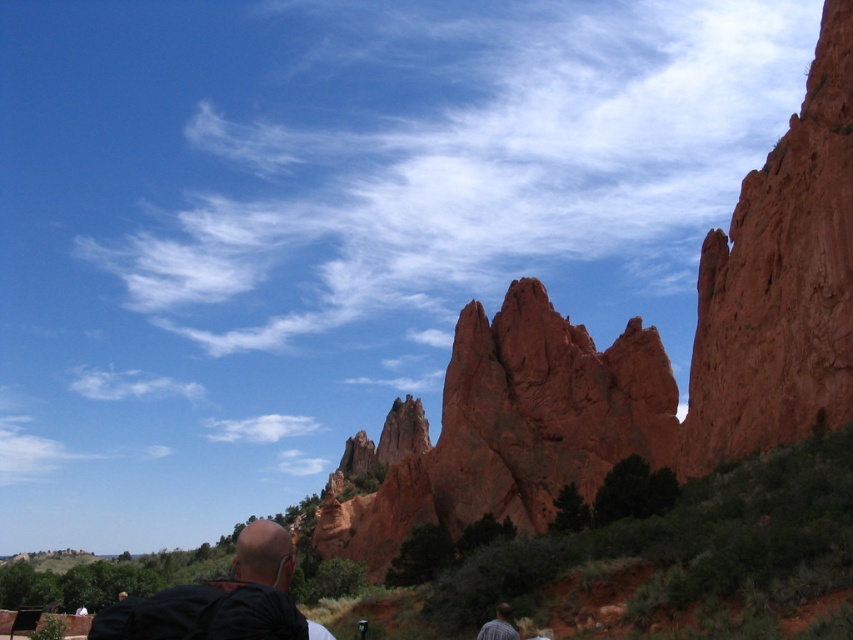
You are standing at the base of the rustic sandstone rock formation at center. If you look straight ahead, what direction would you face relative to the rock formation?

Since the rustic sandstone rock formation at center is located at point (505,429), facing straight ahead from its base would mean looking towards the center of the image.

You are a photographer planning to take a picture of the rustic sandstone rock formation at center and the black leather jacket at lower left. Based on their positions, which object is located to the right of the other?

The rustic sandstone rock formation at center is positioned on the right side of black leather jacket at lower left.

You are a photographer planning to take a picture of the red rock formations. You want to ensure the black leather jacket at lower left is not in the frame. Based on its 2D coordinates, can you estimate whether it will be visible in the photo if you center your camera on the main rock formations?

The black leather jacket at lower left is located at coordinates [221,600], which is near the edge of the frame. If the camera is centered on the main rock formations, the jacket may still be partially visible depending on the camera angle and zoom level. However, adjusting the framing slightly to exclude the lower left corner could ensure it is not in the shot.